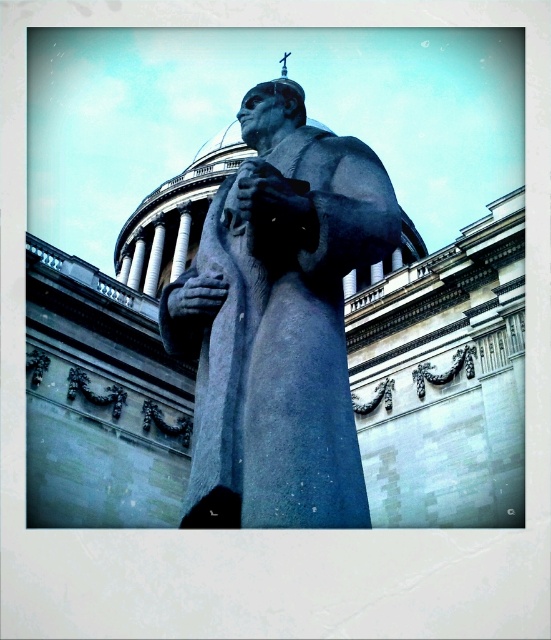
Based on the photo, is gray stone statue at center to the right of white marble pillar at center from the viewer's perspective?

Yes, gray stone statue at center is to the right of white marble pillar at center.

Is gray stone statue at center taller than white marble pillar at center?

Indeed, gray stone statue at center has a greater height compared to white marble pillar at center.

Locate an element on the screen. The height and width of the screenshot is (640, 551). gray stone statue at center is located at coordinates (282, 323).

Is gray stone statue at center shorter than smooth gray hand at center?

No, gray stone statue at center is not shorter than smooth gray hand at center.

Does gray stone statue at center appear on the right side of smooth gray hand at center?

Incorrect, gray stone statue at center is not on the right side of smooth gray hand at center.

Is point (287, 326) farther from camera compared to point (171, 312)?

No, (287, 326) is in front of (171, 312).

Locate an element on the screen. The image size is (551, 640). gray stone statue at center is located at coordinates (282, 323).

Is point (170, 333) more distant than point (295, 180)?

Yes.

Is gray stone statue at center shorter than matte gray stone hand at center?

No, gray stone statue at center is not shorter than matte gray stone hand at center.

Is point (272, 164) closer to camera compared to point (272, 168)?

No, it is behind (272, 168).

Locate an element on the screen. The height and width of the screenshot is (640, 551). gray stone statue at center is located at coordinates (282, 323).